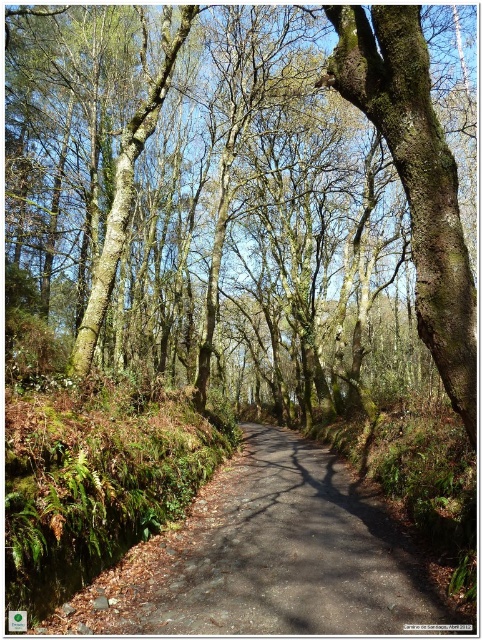
You are standing at the coordinates 0.5, 0.5 in the image. You want to walk to the dark gray asphalt road at center. In which direction should you move?

You should move towards the coordinates (x=290, y=554) to reach the dark gray asphalt road at center.

You are a hiker walking along the forest path and want to know if the dark gray asphalt road at center is visible from your current position. Can you see it behind the rough bark tree at center?

The dark gray asphalt road at center is behind the rough bark tree at center, so yes, you can see it behind the rough bark tree at center.

You are a hiker trying to estimate the space between two landmarks on a forest path. You see a rough bark tree at center and a dark gray asphalt road at center. Which object is wider?

The rough bark tree at center is wider than the dark gray asphalt road at center according to the description provided.